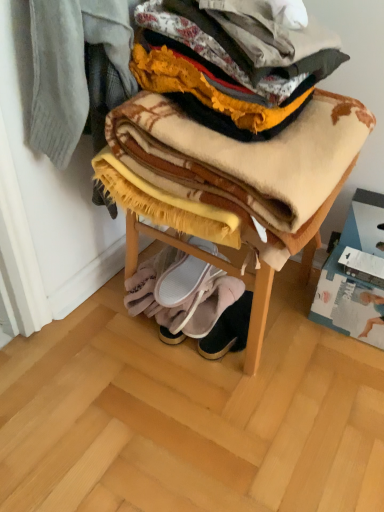
Question: Which direction should I rotate to look at white fabric slipper at lower center, the second footwear viewed from the top, — up or down?

Choices:
 (A) down
 (B) up

Answer: (A)

Question: Is soft yellow fleece blanket at lower center, which is the 2th blanket from top to bottom, in contact with soft woolen blanket at center?

Choices:
 (A) yes
 (B) no

Answer: (B)

Question: Can we say soft yellow fleece blanket at lower center, which is the 2th blanket from top to bottom, lies outside soft woolen blanket at center?

Choices:
 (A) no
 (B) yes

Answer: (B)

Question: Considering the relative positions of soft yellow fleece blanket at lower center, which is the 2th blanket from top to bottom, and soft woolen blanket at center in the image provided, is soft yellow fleece blanket at lower center, which is the 2th blanket from top to bottom, behind soft woolen blanket at center?

Choices:
 (A) yes
 (B) no

Answer: (A)

Question: Would you say soft woolen blanket at center is part of soft yellow fleece blanket at lower center, which is the 2th blanket from top to bottom,'s contents?

Choices:
 (A) yes
 (B) no

Answer: (B)

Question: Is soft yellow fleece blanket at lower center, the 2th blanket positioned from the front, taller than soft woolen blanket at center?

Choices:
 (A) no
 (B) yes

Answer: (A)

Question: Considering the relative positions of soft yellow fleece blanket at lower center, which is the 2th blanket from top to bottom, and soft woolen blanket at center in the image provided, is soft yellow fleece blanket at lower center, which is the 2th blanket from top to bottom, to the left of soft woolen blanket at center from the viewer's perspective?

Choices:
 (A) yes
 (B) no

Answer: (A)

Question: Can you confirm if leather suede booties at lower center, positioned as the 1th footwear in bottom-to-top order, is smaller than soft yellow fleece blanket at lower center, which is the first blanket from back to front?

Choices:
 (A) yes
 (B) no

Answer: (A)

Question: Is leather suede booties at lower center, positioned as the 1th footwear in bottom-to-top order, to the right of soft yellow fleece blanket at lower center, which is the first blanket from back to front, from the viewer's perspective?

Choices:
 (A) no
 (B) yes

Answer: (B)

Question: Is leather suede booties at lower center, the third footwear viewed from the top, facing towards soft yellow fleece blanket at lower center, marked as the 1th blanket in a bottom-to-top arrangement?

Choices:
 (A) yes
 (B) no

Answer: (B)

Question: Is leather suede booties at lower center, positioned as the 1th footwear in bottom-to-top order, closer to the viewer compared to soft yellow fleece blanket at lower center, which is the first blanket from back to front?

Choices:
 (A) yes
 (B) no

Answer: (A)

Question: Is the position of leather suede booties at lower center, positioned as the 1th footwear in bottom-to-top order, more distant than that of soft yellow fleece blanket at lower center, which is the first blanket from back to front?

Choices:
 (A) yes
 (B) no

Answer: (B)

Question: Is leather suede booties at lower center, positioned as the 1th footwear in bottom-to-top order, not within soft yellow fleece blanket at lower center, marked as the 1th blanket in a bottom-to-top arrangement?

Choices:
 (A) yes
 (B) no

Answer: (A)

Question: Can plaid woolen blanket at center, acting as the 1th blanket starting from the top, be found inside white suede slippers at lower center, positioned as the first footwear in top-to-bottom order?

Choices:
 (A) yes
 (B) no

Answer: (B)